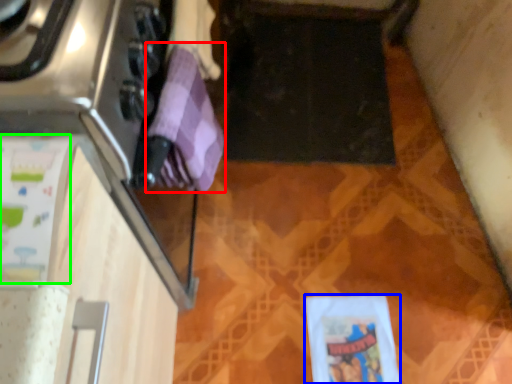
Question: Estimate the real-world distances between objects in this image. Which object is closer to wrapping paper (highlighted by a red box), wrapping paper (highlighted by a blue box) or wrapping paper (highlighted by a green box)?

Choices:
 (A) wrapping paper
 (B) wrapping paper

Answer: (B)